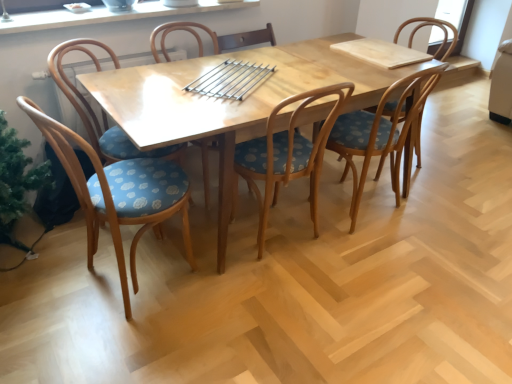
Where is `free space between blue polka dot wood chair at left, which appears as the fifth chair when viewed from the right, and wooden chair with blue polka dot seat at center, which ranks as the 3th chair in right-to-left order`? This screenshot has height=384, width=512. free space between blue polka dot wood chair at left, which appears as the fifth chair when viewed from the right, and wooden chair with blue polka dot seat at center, which ranks as the 3th chair in right-to-left order is located at coordinates (225, 264).